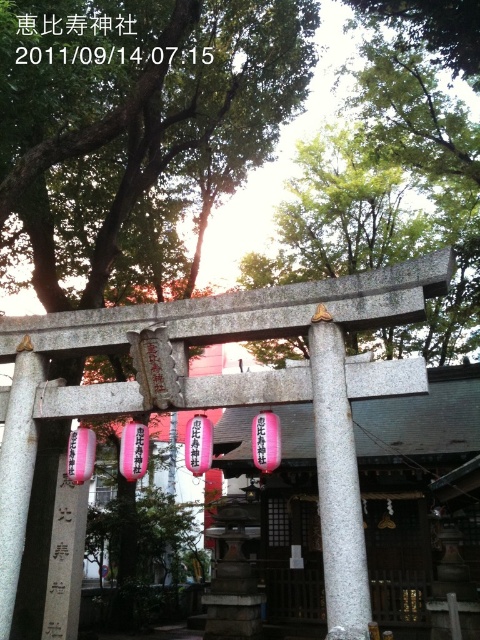
Question: Based on their relative distances, which object is farther from the black paper at upper center?

Choices:
 (A) black stone sign at center
 (B) gray granite pole at center

Answer: (B)

Question: Is black paper at upper center positioned before black stone sign at center?

Choices:
 (A) no
 (B) yes

Answer: (B)

Question: Is black paper at upper center below black stone sign at center?

Choices:
 (A) yes
 (B) no

Answer: (B)

Question: Which point is farther to the camera?

Choices:
 (A) black stone sign at center
 (B) gray granite pole at center
 (C) black paper at upper center

Answer: (A)

Question: Which point is closer to the camera taking this photo?

Choices:
 (A) (57, 22)
 (B) (359, 561)

Answer: (B)

Question: Does gray granite pole at center come behind black stone sign at center?

Choices:
 (A) no
 (B) yes

Answer: (A)